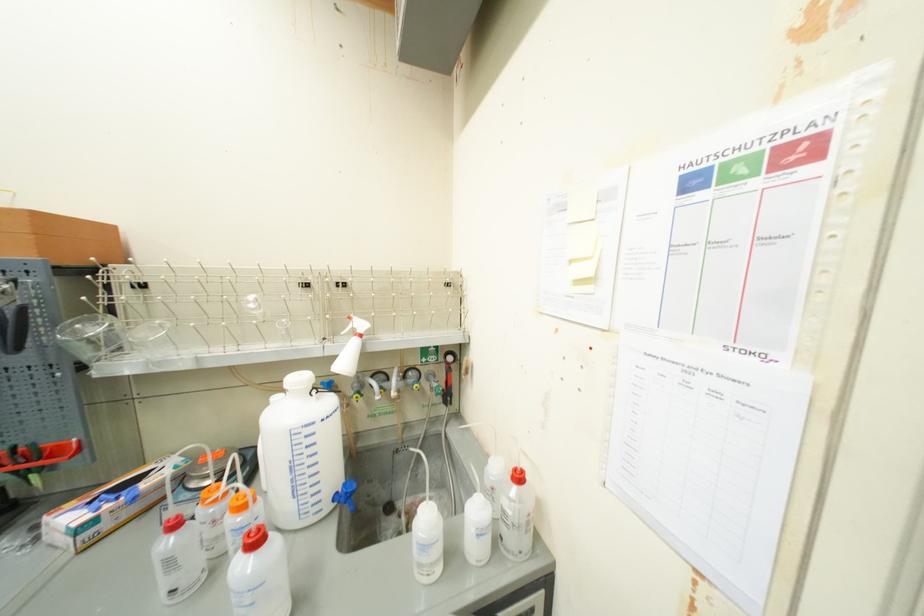
Where is `cardboard box`? cardboard box is located at coordinates (58, 238).